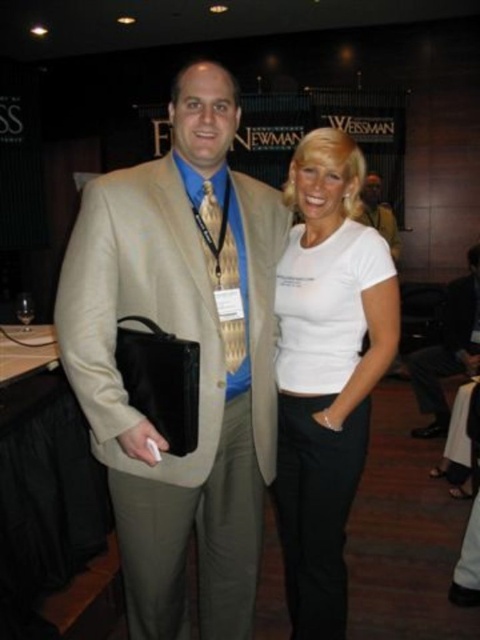
You are standing in a conference hall and see the white matte shirt at center. If you want to shake hands with the person wearing it, will you be able to reach them without moving closer?

The white matte shirt at center and viewer are 5.27 feet apart. Since the typical arm length for an average adult is about 2.5 feet, you would need to move closer to reach them for a handshake.

You are a photographer setting up for a group photo at an event. You need to position two subjects so they are closer together than 8 feet apart. The subjects are wearing the white matte shirt at center and the light beige suit at center. Can you place them within the required distance based on their current positions?

The white matte shirt at center is 7.14 feet from the light beige suit at center, which is within the 8 feet requirement. Yes, they can be positioned within the required distance.